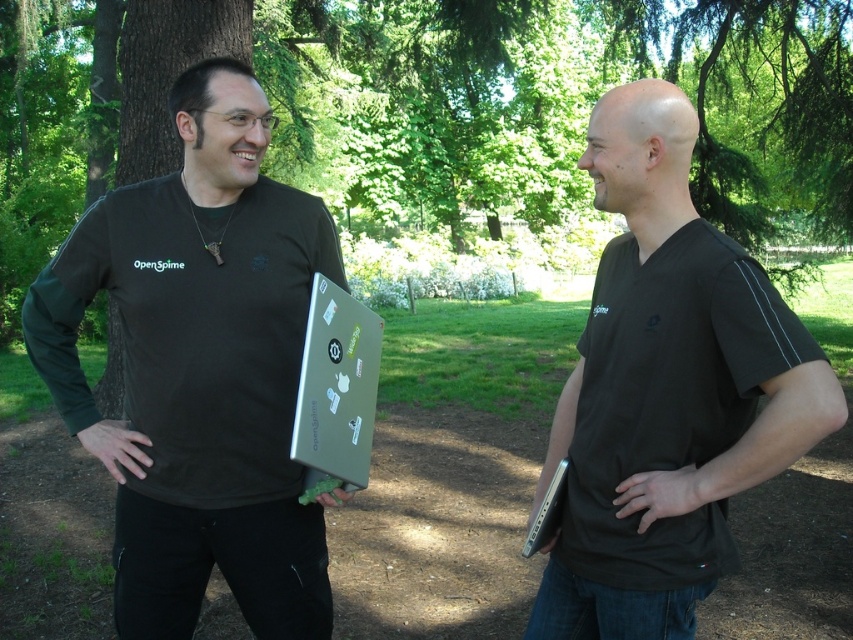
You are standing in the park and want to take a photo of the green leafy tree at center. If you move 0.167 meters to the left and 0.519 meters forward from your current position, will you be directly in front of the tree?

Yes, moving 0.167 meters to the left and 0.519 meters forward from your current position will place you directly in front of the green leafy tree at center, as its position is at point coordinates (442, 106).

You are a photographer trying to capture a photo of the silver metallic laptop at center without the green leafy tree at center blocking the view. Based on their sizes, is it possible to frame the shot so the laptop is fully visible without any part of the tree overlapping?

The green leafy tree at center is taller than the silver metallic laptop at center, so if the tree is positioned behind the laptop, it might still block the view depending on their arrangement. However, since the question focuses on size rather than position, the laptop could be framed to avoid overlap by adjusting the camera angle or moving closer to emphasize the laptop while excluding the tree.